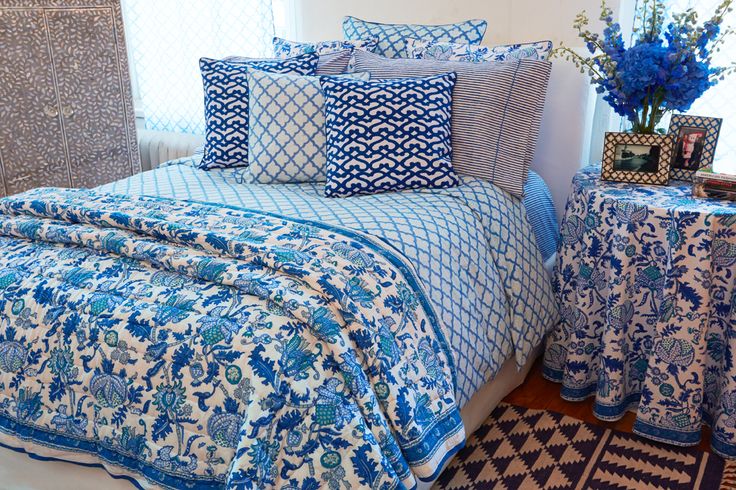
Locate an element on the screen. The image size is (736, 490). window is located at coordinates (130, 83).